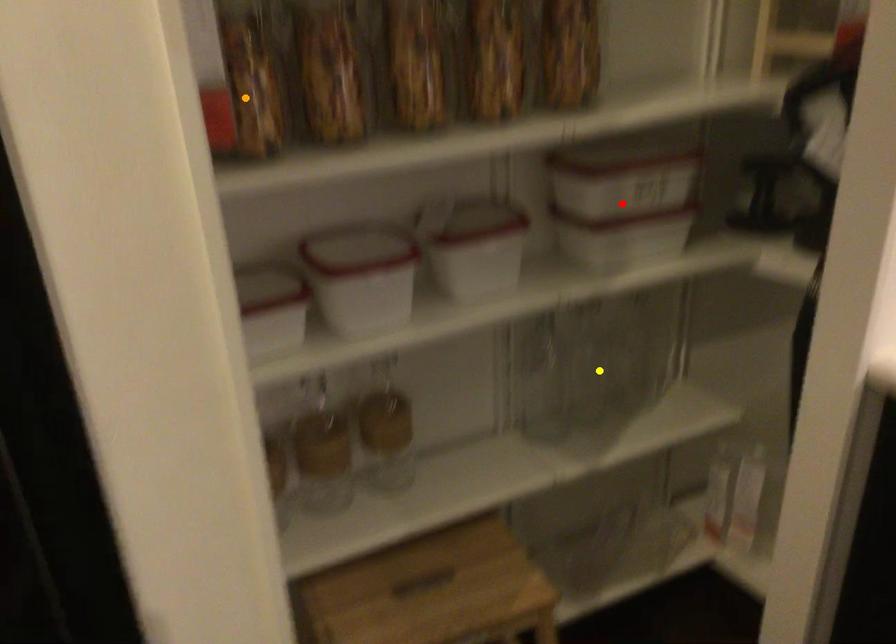
Based on the photo, order these from nearest to farthest:
orange point | yellow point | red point

1. yellow point
2. red point
3. orange point